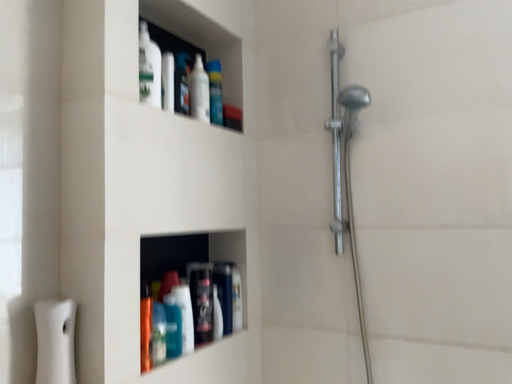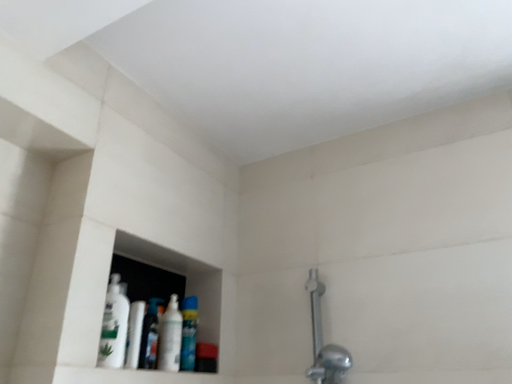
Question: How did the camera likely rotate when shooting the video?

Choices:
 (A) rotated downward
 (B) rotated upward

Answer: (B)